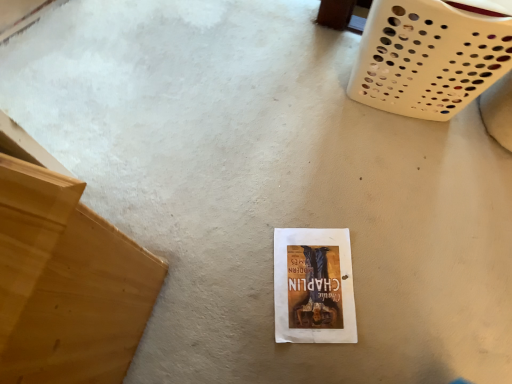
Question: Is light brown wood at left bigger than white paper at center?

Choices:
 (A) no
 (B) yes

Answer: (B)

Question: Considering the relative positions of light brown wood at left and white paper at center in the image provided, is light brown wood at left in front of white paper at center?

Choices:
 (A) yes
 (B) no

Answer: (A)

Question: Can you confirm if light brown wood at left is smaller than white paper at center?

Choices:
 (A) no
 (B) yes

Answer: (A)

Question: From a real-world perspective, is light brown wood at left below white paper at center?

Choices:
 (A) no
 (B) yes

Answer: (A)

Question: Is light brown wood at left positioned behind white paper at center?

Choices:
 (A) yes
 (B) no

Answer: (B)

Question: From the image's perspective, does light brown wood at left appear lower than white paper at center?

Choices:
 (A) no
 (B) yes

Answer: (A)

Question: Is white paper at center positioned far away from white plastic basket at upper right?

Choices:
 (A) yes
 (B) no

Answer: (B)

Question: From the image's perspective, would you say white paper at center is shown under white plastic basket at upper right?

Choices:
 (A) yes
 (B) no

Answer: (A)

Question: Does white paper at center come behind white plastic basket at upper right?

Choices:
 (A) yes
 (B) no

Answer: (A)

Question: Is white paper at center thinner than white plastic basket at upper right?

Choices:
 (A) yes
 (B) no

Answer: (A)

Question: Is white paper at center wider than white plastic basket at upper right?

Choices:
 (A) yes
 (B) no

Answer: (B)

Question: Does white paper at center contain white plastic basket at upper right?

Choices:
 (A) yes
 (B) no

Answer: (B)

Question: Is white plastic basket at upper right aimed at white paper at center?

Choices:
 (A) no
 (B) yes

Answer: (B)